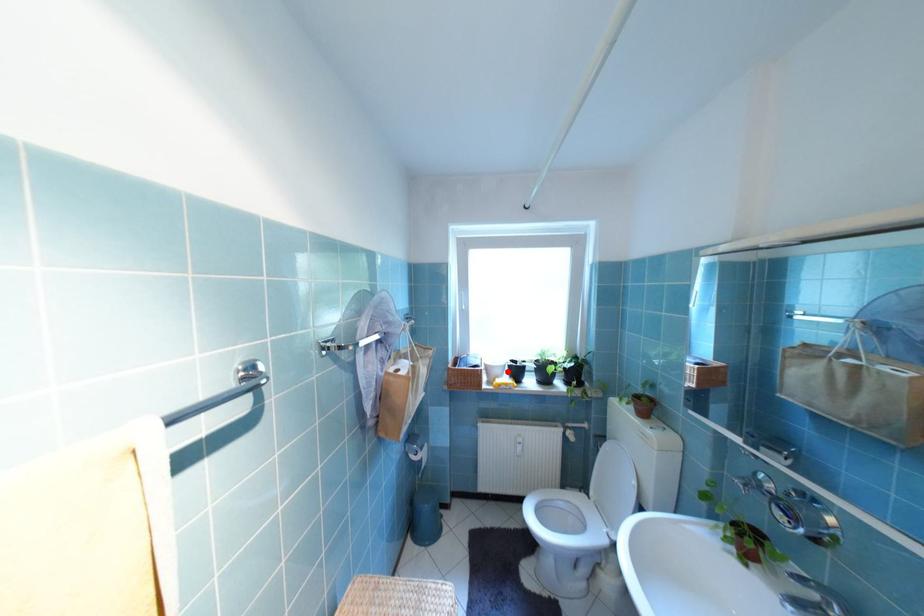
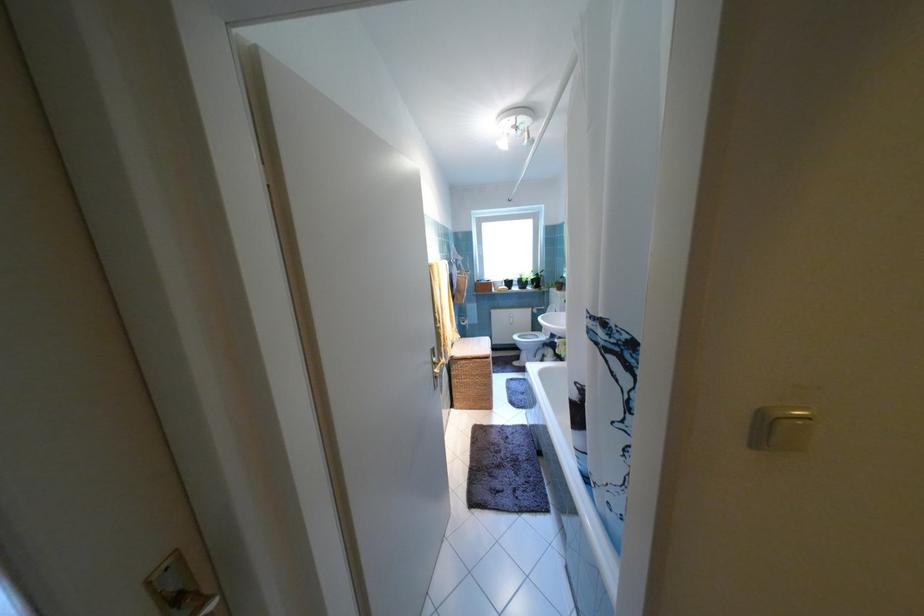
Question: I am providing you with two images of the same scene from different viewpoints. Given a red point in image1, look at the same physical point in image2. Is it:

Choices:
 (A) Closer to the viewpoint
 (B) Farther from the viewpoint

Answer: (A)